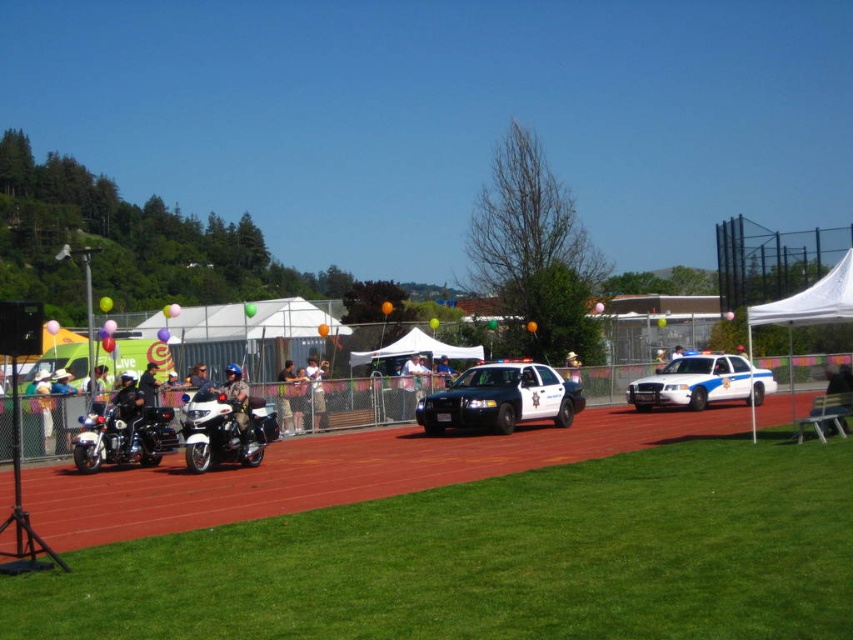
Question: Considering the real-world distances, which object is farthest from the light brown leather jacket at center?

Choices:
 (A) khaki woven hat at center
 (B) metallic blue helmet at center
 (C) smooth asphalt race track at center
 (D) shiny chrome motorcycle at left

Answer: (A)

Question: Is brushed metal motorcycle at left to the right of khaki woven hat at center from the viewer's perspective?

Choices:
 (A) yes
 (B) no

Answer: (B)

Question: Does white glossy police car at right appear over shiny chrome motorcycle at left?

Choices:
 (A) yes
 (B) no

Answer: (A)

Question: From the image, what is the correct spatial relationship of brushed metal motorcycle at left in relation to white fabric shirt at center?

Choices:
 (A) right
 (B) left

Answer: (B)

Question: Among these objects, which one is farthest from the camera?

Choices:
 (A) brushed metal motorcycle at left
 (B) smooth asphalt race track at center
 (C) shiny chrome motorcycle at left
 (D) khaki woven hat at center

Answer: (D)

Question: Which point is farther from the camera taking this photo?

Choices:
 (A) (764, 420)
 (B) (235, 413)
 (C) (312, 384)

Answer: (C)